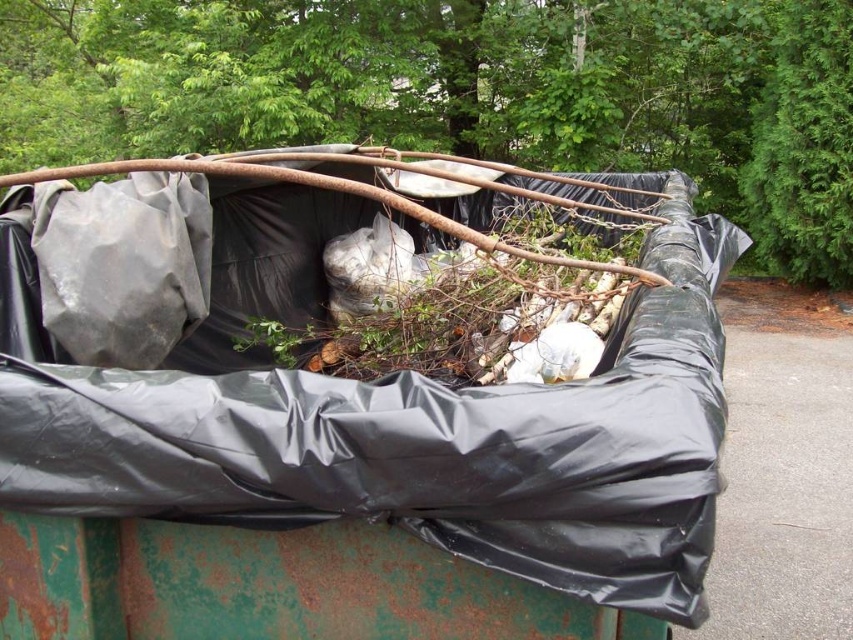
Question: Among these objects, which one is nearest to the camera?

Choices:
 (A) black plastic bin at center
 (B) rusty metal tree at upper center

Answer: (A)

Question: Can you confirm if black plastic bin at center is smaller than rusty metal tree at upper center?

Choices:
 (A) yes
 (B) no

Answer: (A)

Question: Is the position of black plastic bin at center less distant than that of rusty metal tree at upper center?

Choices:
 (A) no
 (B) yes

Answer: (B)

Question: Does black plastic bin at center appear under rusty metal tree at upper center?

Choices:
 (A) yes
 (B) no

Answer: (A)

Question: Which point is farther to the camera?

Choices:
 (A) rusty metal tree at upper center
 (B) black plastic bin at center

Answer: (A)